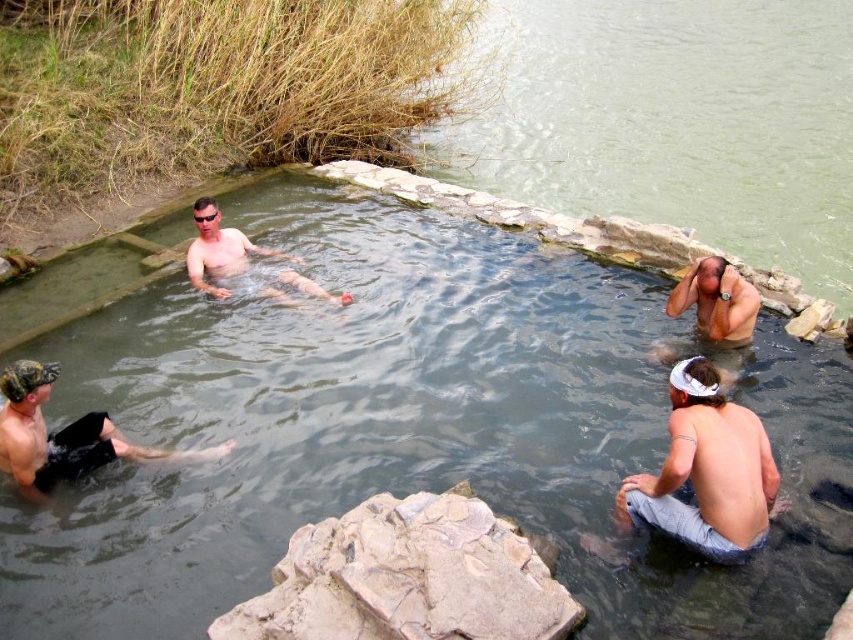
Between rough textured rock at center and gray denim shorts at lower right, which one appears on the right side from the viewer's perspective?

From the viewer's perspective, gray denim shorts at lower right appears more on the right side.

You are a GUI agent. You are given a task and a screenshot of the screen. Output one action in this format:
    pyautogui.click(x=<x>, y=<y>)
    Task: Click on the rough textured rock at center
    
    Given the screenshot: What is the action you would take?
    pyautogui.click(x=407, y=579)

Can you confirm if black matte shorts at lower left is positioned to the right of smooth skin head at upper right?

In fact, black matte shorts at lower left is to the left of smooth skin head at upper right.

Is black matte shorts at lower left to the left of smooth skin head at upper right from the viewer's perspective?

Yes, black matte shorts at lower left is to the left of smooth skin head at upper right.

The width and height of the screenshot is (853, 640). I want to click on black matte shorts at lower left, so click(x=61, y=435).

Is matte skin man at center smaller than smooth skin head at upper right?

Actually, matte skin man at center might be larger than smooth skin head at upper right.

Is matte skin man at center taller than smooth skin head at upper right?

Yes, matte skin man at center is taller than smooth skin head at upper right.

Who is more distant from viewer, (276, 276) or (723, 301)?

Positioned behind is point (276, 276).

Where is `matte skin man at center`? matte skin man at center is located at coordinates (219, 250).